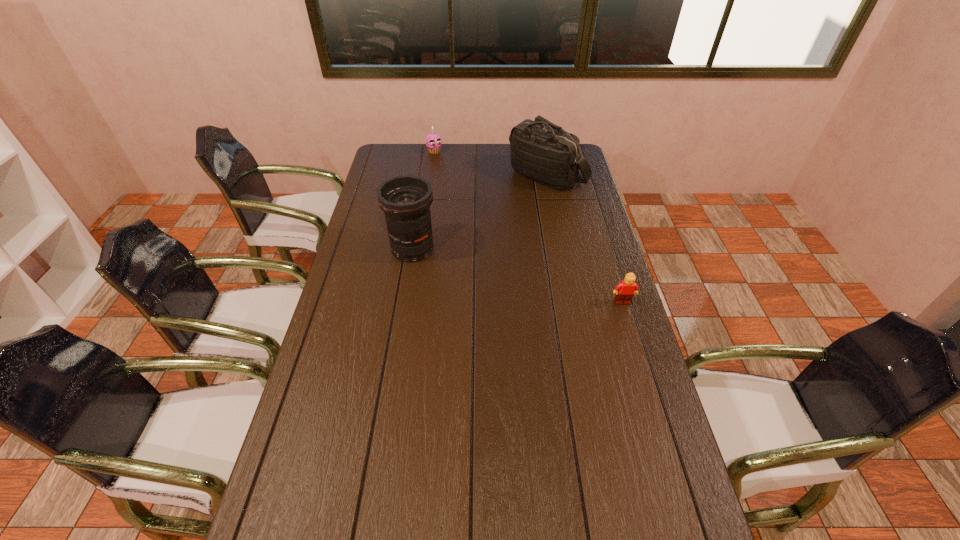
Find the location of `free point that satisfies the following two spatial constraints: 1. on the back side of the third farthest object; 2. on the right side of the cupcake`. free point that satisfies the following two spatial constraints: 1. on the back side of the third farthest object; 2. on the right side of the cupcake is located at coordinates (428, 152).

This screenshot has width=960, height=540. In order to click on free location that satisfies the following two spatial constraints: 1. on the back side of the second farthest object; 2. on the right side of the third farthest object in this screenshot , I will do `click(424, 176)`.